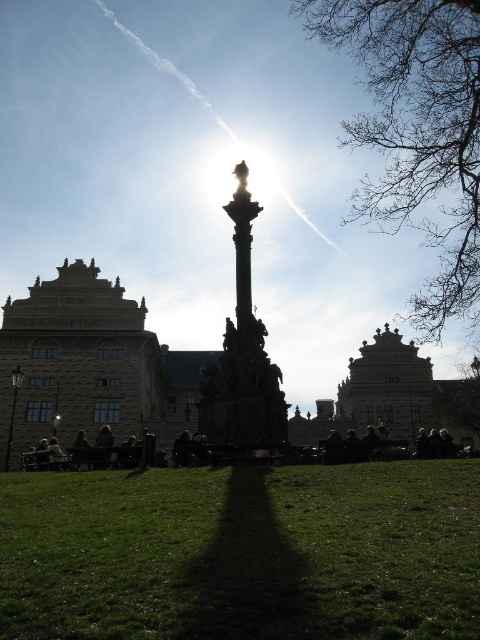
What do you see at coordinates (78, 362) in the screenshot? I see `dark brown stone tower at left` at bounding box center [78, 362].

Identify the location of dark brown stone tower at left. This screenshot has height=640, width=480. (78, 362).

Is point (67, 406) farther from viewer compared to point (420, 397)?

No, (67, 406) is closer to viewer.

Identify the location of dark brown stone tower at left. The height and width of the screenshot is (640, 480). (78, 362).

Does dark brown stone tower at left appear under silhouette stone column at center?

Indeed, dark brown stone tower at left is positioned under silhouette stone column at center.

Does dark brown stone tower at left have a greater width compared to silhouette stone column at center?

Yes, dark brown stone tower at left is wider than silhouette stone column at center.

The image size is (480, 640). In order to click on dark brown stone tower at left in this screenshot , I will do `click(78, 362)`.

Which is behind, point (313, 497) or point (78, 262)?

The point (78, 262) is more distant.

Does green grass at center have a greater width compared to dark brown stone tower at left?

Yes.

Measure the distance between point (204, 598) and camera.

Point (204, 598) is 48.54 meters away from camera.

Image resolution: width=480 pixels, height=640 pixels. In order to click on green grass at center in this screenshot , I will do coord(242,552).